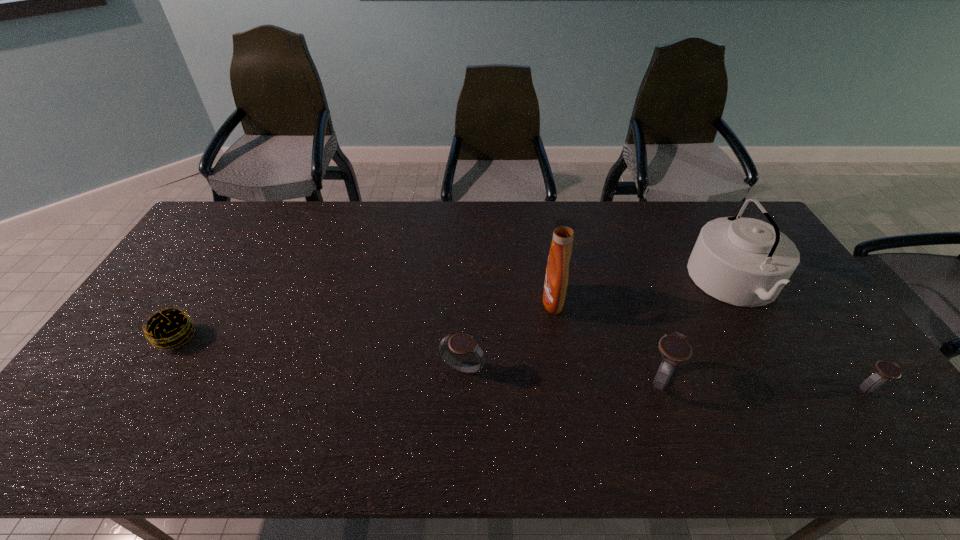
The width and height of the screenshot is (960, 540). I want to click on free space for a new watch on the left, so click(x=272, y=359).